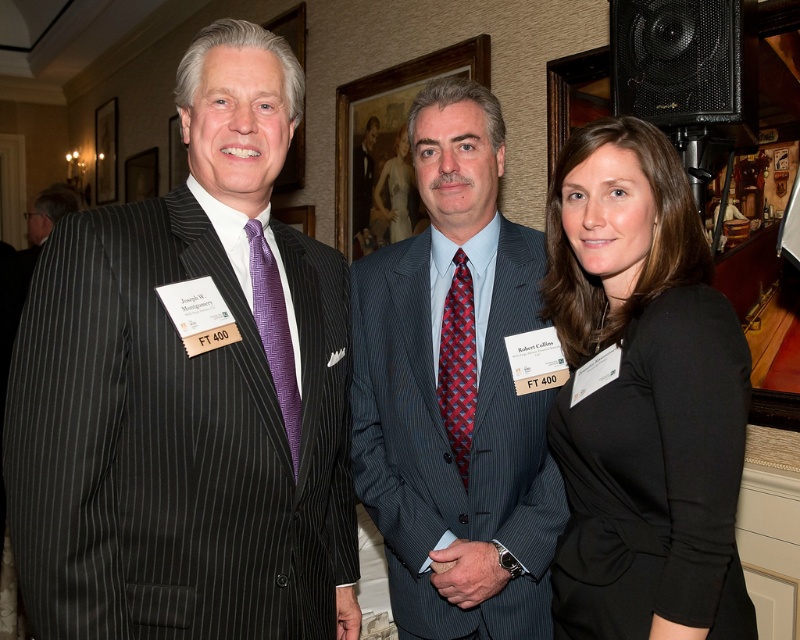
Between matte black suit at left and black matte dress at center, which one has less height?

With less height is black matte dress at center.

Is point (332, 595) positioned after point (652, 259)?

That is True.

The height and width of the screenshot is (640, 800). Identify the location of matte black suit at left. (189, 392).

Which is more to the right, red plaid silk tie at center or smooth white dress at center?

Positioned to the right is red plaid silk tie at center.

Locate an element on the screen. This screenshot has height=640, width=800. red plaid silk tie at center is located at coordinates (458, 364).

The width and height of the screenshot is (800, 640). Find the location of `red plaid silk tie at center`. red plaid silk tie at center is located at coordinates (458, 364).

Who is positioned more to the left, black mesh speaker at upper right or red plaid silk tie at center?

red plaid silk tie at center is more to the left.

Between black mesh speaker at upper right and red plaid silk tie at center, which one is positioned lower?

red plaid silk tie at center

Does point (638, 113) lie in front of point (445, 422)?

No, it is not.

The image size is (800, 640). I want to click on black mesh speaker at upper right, so click(x=678, y=60).